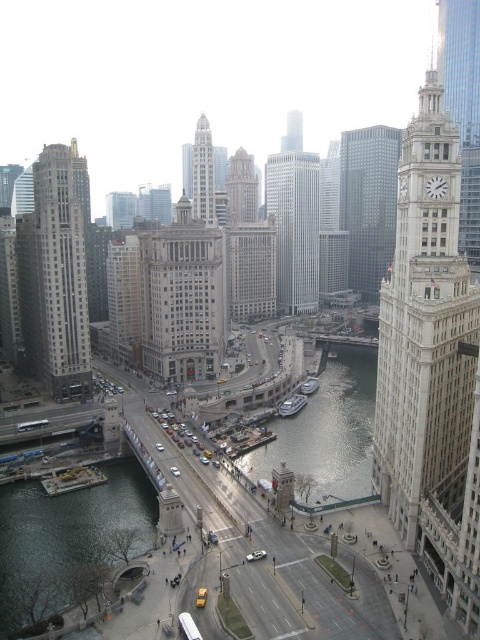
Question: Can you confirm if matte gold building at center is thinner than white plastic boat at center?

Choices:
 (A) yes
 (B) no

Answer: (B)

Question: Which of the following is the closest to the observer?

Choices:
 (A) green glass building at center
 (B) glassy steel skyscraper at center
 (C) beige stone building at center
 (D) clear water at center

Answer: (D)

Question: Can you confirm if dark gray stone skyscraper at left is wider than gray stone skyscraper at center?

Choices:
 (A) yes
 (B) no

Answer: (A)

Question: Is greenish water at lower left positioned in front of green glass building at center?

Choices:
 (A) yes
 (B) no

Answer: (A)

Question: Which point appears closest to the camera in this image?

Choices:
 (A) (312, 161)
 (B) (192, 240)

Answer: (B)

Question: Which of the following is the closest to the observer?

Choices:
 (A) glassy steel skyscraper at center
 (B) gray stone skyscraper at center

Answer: (B)